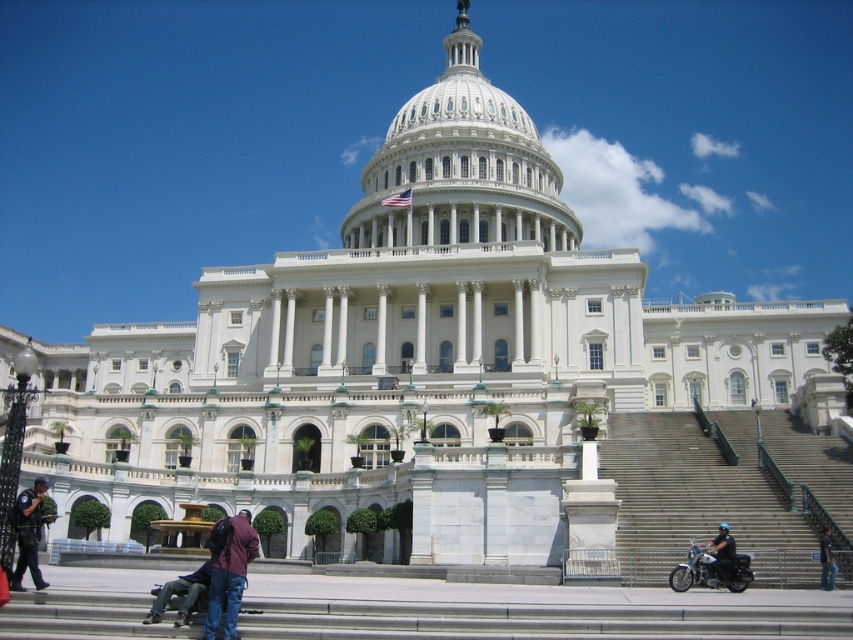
Who is more forward, (210, 563) or (42, 513)?

Positioned in front is point (210, 563).

Does maroon fabric jacket at lower left come in front of dark blue uniform at lower left?

Yes, it is.

Identify the location of maroon fabric jacket at lower left. (228, 570).

Can you confirm if white marble dome at center is wider than denim pants at lower left?

Yes.

Is white marble dome at center to the right of denim pants at lower left from the viewer's perspective?

Indeed, white marble dome at center is positioned on the right side of denim pants at lower left.

Between point (512, 122) and point (160, 602), which one is positioned in front?

Point (160, 602) is in front.

Locate an element on the screen. white marble dome at center is located at coordinates (460, 163).

Is gray concrete stairs at lower right thinner than denim pants at lower left?

No, gray concrete stairs at lower right is not thinner than denim pants at lower left.

Between gray concrete stairs at lower right and denim pants at lower left, which one appears on the left side from the viewer's perspective?

From the viewer's perspective, denim pants at lower left appears more on the left side.

This screenshot has height=640, width=853. I want to click on gray concrete stairs at lower right, so click(723, 490).

Where is `gray concrete stairs at lower right`? gray concrete stairs at lower right is located at coordinates pyautogui.click(x=723, y=490).